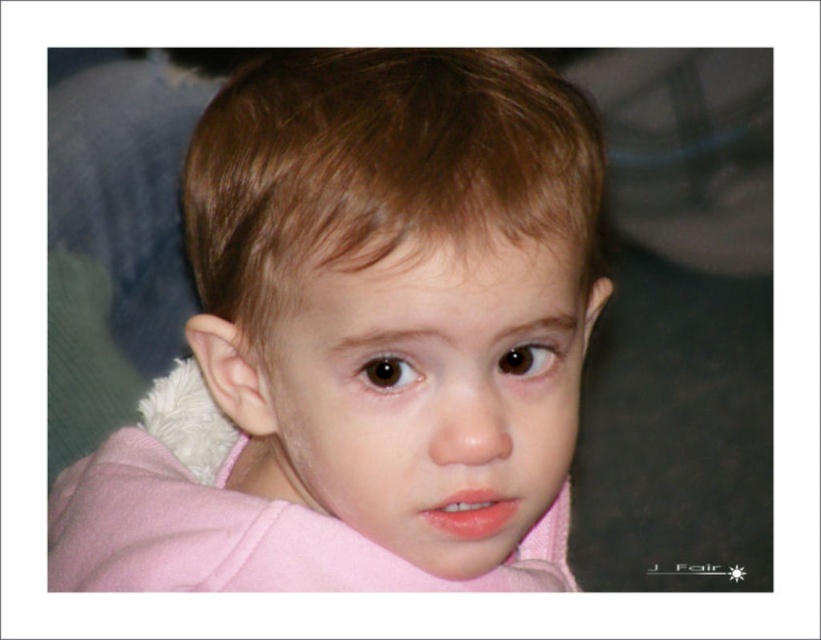
Question: Which point is farther from the camera taking this photo?

Choices:
 (A) (236, 188)
 (B) (398, 404)

Answer: (A)

Question: Which object is closer to the camera taking this photo?

Choices:
 (A) pink fabric at center
 (B) pink fleece at center

Answer: (B)

Question: Does pink fleece at center appear on the left side of pink fabric at center?

Choices:
 (A) no
 (B) yes

Answer: (B)

Question: Which of the following is the closest to the observer?

Choices:
 (A) pink fleece at center
 (B) pink fabric at center

Answer: (A)

Question: Can you confirm if pink fleece at center is smaller than pink fabric at center?

Choices:
 (A) yes
 (B) no

Answer: (B)

Question: Considering the relative positions of pink fleece at center and pink fabric at center in the image provided, where is pink fleece at center located with respect to pink fabric at center?

Choices:
 (A) left
 (B) right

Answer: (A)